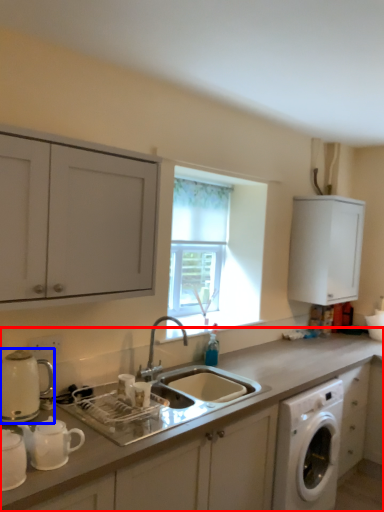
Question: Which of the following is the farthest to the observer, countertop (highlighted by a red box) or appliance (highlighted by a blue box)?

Choices:
 (A) countertop
 (B) appliance

Answer: (B)